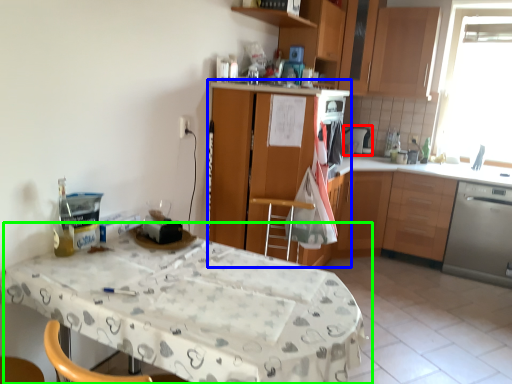
Question: Which is farther away from appliance (highlighted by a red box)? cabinetry (highlighted by a blue box) or table (highlighted by a green box)?

Choices:
 (A) cabinetry
 (B) table

Answer: (B)